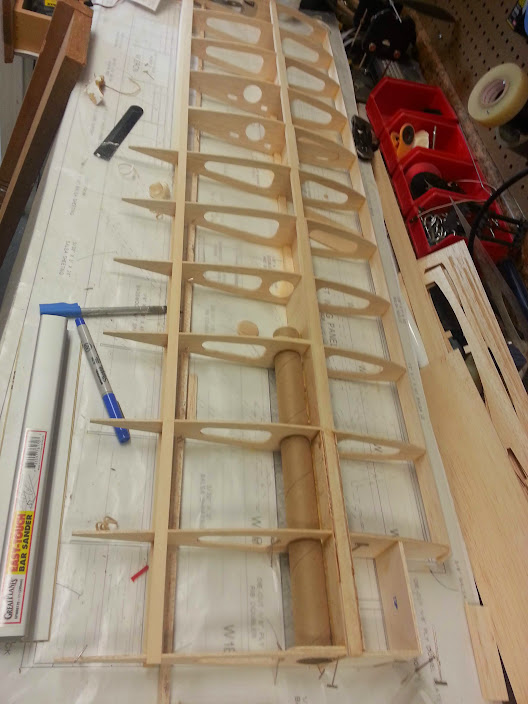
Identify the location of wood shelving. (160, 543).